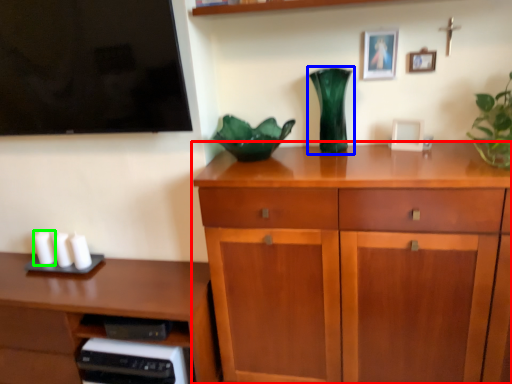
Question: Estimate the real-world distances between objects in this image. Which object is farther from chest of drawers (highlighted by a red box), vase (highlighted by a blue box) or candle (highlighted by a green box)?

Choices:
 (A) vase
 (B) candle

Answer: (B)